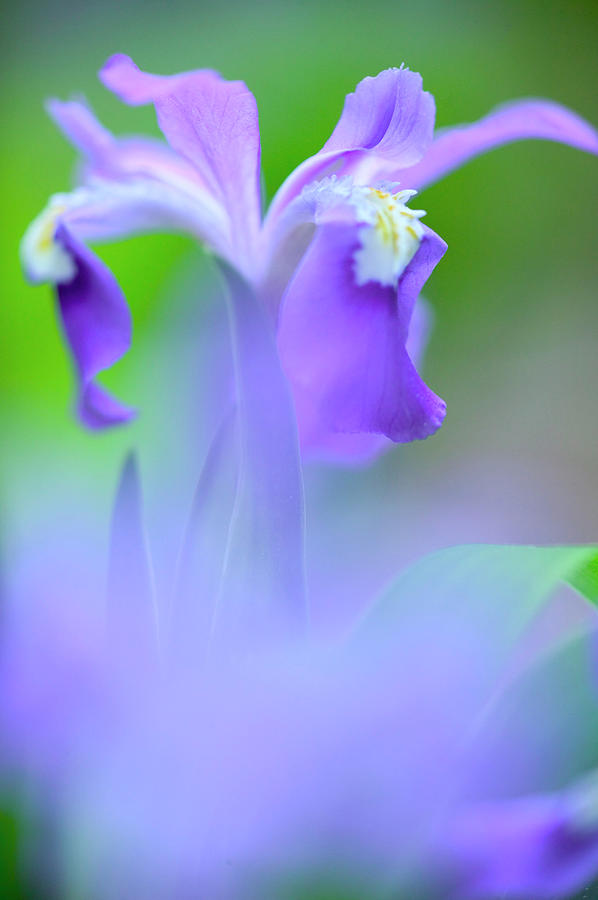
This screenshot has width=598, height=900. I want to click on purple shade, so click(x=557, y=846).